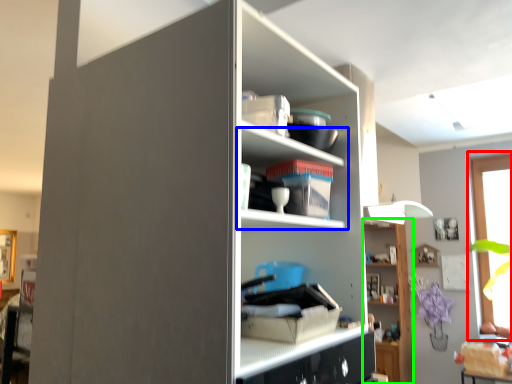
Question: Considering the real-world distances, which object is farthest from window (highlighted by a red box)? shelf (highlighted by a blue box) or shelf (highlighted by a green box)?

Choices:
 (A) shelf
 (B) shelf

Answer: (A)